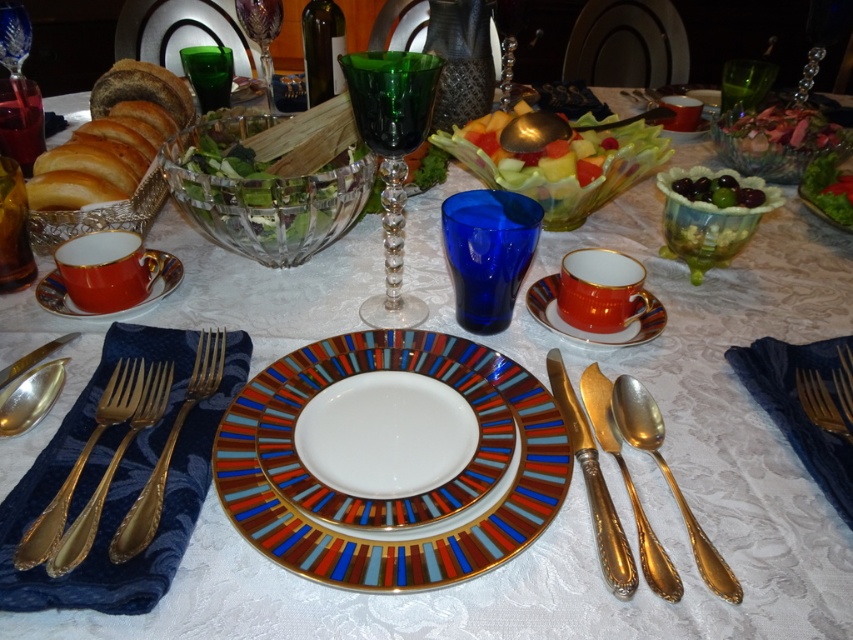
Question: Is the position of translucent plastic salad at center less distant than that of green crystal wine glass at center?

Choices:
 (A) yes
 (B) no

Answer: (B)

Question: Which point appears closest to the camera in this image?

Choices:
 (A) (164, 292)
 (B) (154, 470)
 (C) (509, 184)
 (D) (339, 504)

Answer: (D)

Question: Is gold plated fork at lower left closer to the viewer compared to gold metallic spoon at right?

Choices:
 (A) no
 (B) yes

Answer: (A)

Question: Among these points, which one is nearest to the camera?

Choices:
 (A) (222, 339)
 (B) (556, 285)

Answer: (A)

Question: Which object is positioned farthest from the green crystal wine glass at center?

Choices:
 (A) gold metallic fork at upper left
 (B) green glossy grapes at upper right
 (C) gold metallic fork at left

Answer: (A)

Question: Considering the relative positions of green glossy grapes at upper right and gold plated fork at left in the image provided, where is green glossy grapes at upper right located with respect to gold plated fork at left?

Choices:
 (A) right
 (B) left

Answer: (A)